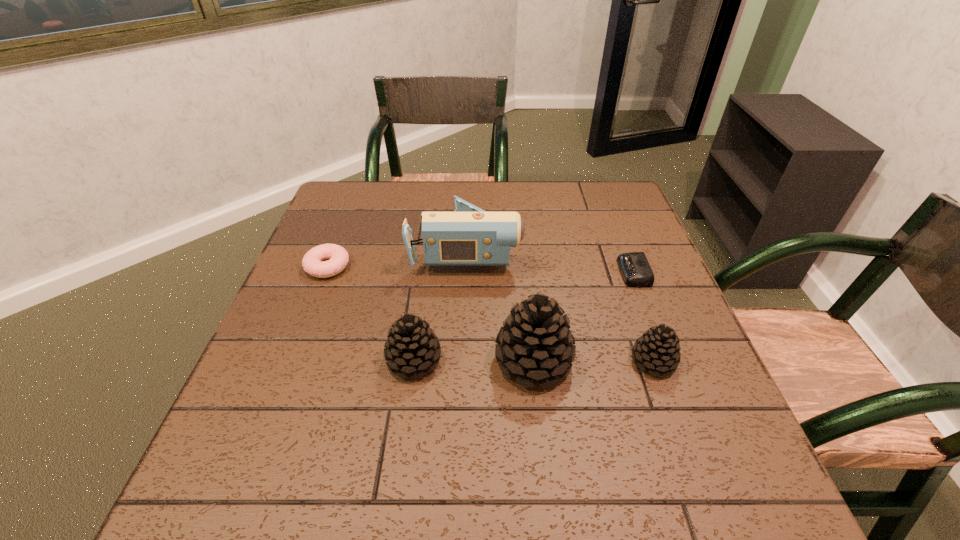
Where is `free space in the image that satisfies the following two spatial constraints: 1. on the side of the camcorder with the flip-out screen; 2. on the front side of the leftmost object`? This screenshot has width=960, height=540. free space in the image that satisfies the following two spatial constraints: 1. on the side of the camcorder with the flip-out screen; 2. on the front side of the leftmost object is located at coordinates (466, 267).